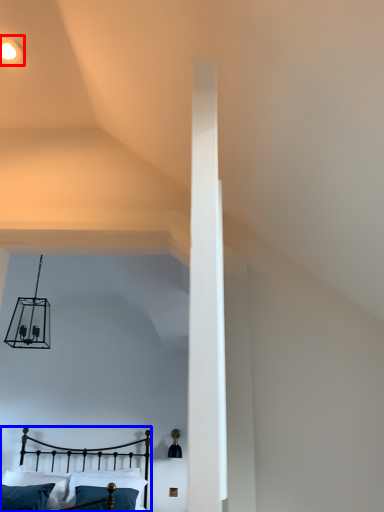
Question: Which object is further to the camera taking this photo, light fixture (highlighted by a red box) or bed (highlighted by a blue box)?

Choices:
 (A) light fixture
 (B) bed

Answer: (B)